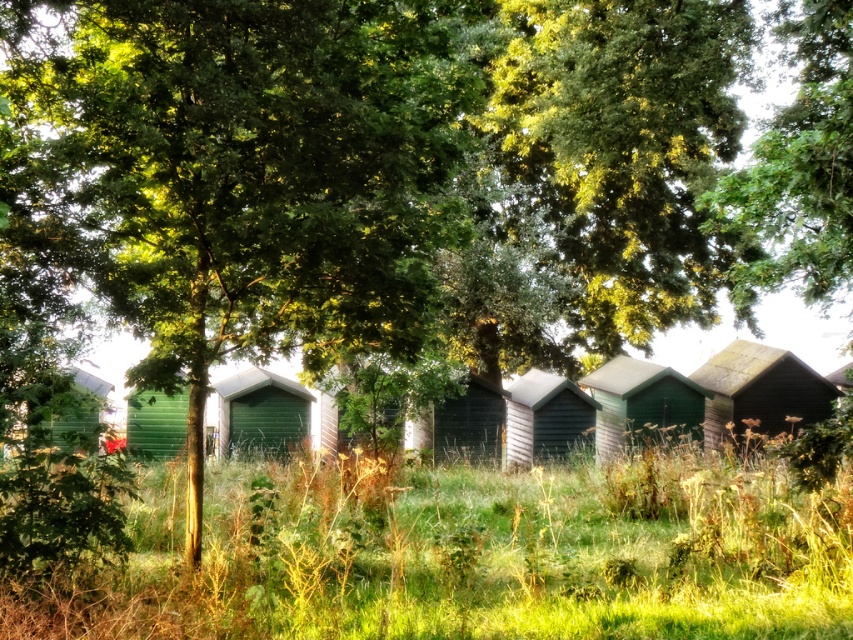
From the picture: Measure the distance between green wood tree at center and camera.

green wood tree at center is 6.93 meters away from camera.

This screenshot has width=853, height=640. Describe the element at coordinates (248, 172) in the screenshot. I see `green wood tree at center` at that location.

Locate an element on the screen. This screenshot has height=640, width=853. green wood tree at center is located at coordinates (248, 172).

Can you confirm if green grass at center is positioned below green wooden hut at lower left?

Indeed, green grass at center is positioned under green wooden hut at lower left.

Find the location of `green grass at center`. green grass at center is located at coordinates (469, 554).

You are a GUI agent. You are given a task and a screenshot of the screen. Output one action in this format:
    pyautogui.click(x=<x>, y=<y>)
    Task: Click on the green grass at center
    
    Given the screenshot: What is the action you would take?
    pyautogui.click(x=469, y=554)

Can you confirm if green wooden hut at center is bigger than green wood beach hut at center?

Yes.

Which of these two, green wooden hut at center or green wood beach hut at center, stands taller?

Standing taller between the two is green wooden hut at center.

What are the coordinates of `green wooden hut at center` in the screenshot? It's located at pos(260,412).

You are a GUI agent. You are given a task and a screenshot of the screen. Output one action in this format:
    pyautogui.click(x=<x>, y=<y>)
    Task: Click on the green wooden hut at center
    
    Given the screenshot: What is the action you would take?
    pyautogui.click(x=260, y=412)